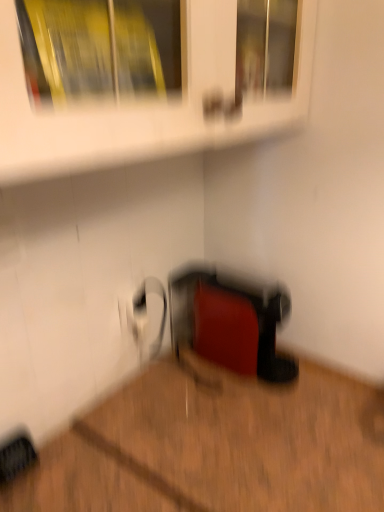
I want to click on free spot above wooden floor at lower right (from a real-world perspective), so click(x=216, y=432).